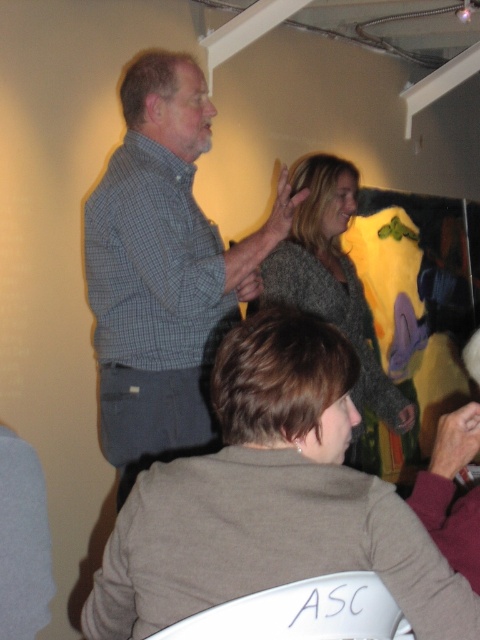
Question: Which is farther from the matte gray sweater at lower center?

Choices:
 (A) knitted gray sweater at upper center
 (B) velvet maroon sweater at lower right
 (C) gray checkered shirt at center

Answer: (A)

Question: Where is matte gray sweater at lower center located in relation to velvet maroon sweater at lower right in the image?

Choices:
 (A) below
 (B) above

Answer: (A)

Question: Which object is farther from the camera taking this photo?

Choices:
 (A) gray checkered shirt at center
 (B) matte gray sweater at lower center
 (C) velvet maroon sweater at lower right

Answer: (A)

Question: Can you confirm if gray checkered shirt at center is positioned to the left of velvet maroon sweater at lower right?

Choices:
 (A) no
 (B) yes

Answer: (B)

Question: Can you confirm if matte gray sweater at lower center is positioned above knitted gray sweater at upper center?

Choices:
 (A) no
 (B) yes

Answer: (A)

Question: Which object appears closest to the camera in this image?

Choices:
 (A) gray checkered shirt at center
 (B) matte gray sweater at lower center
 (C) knitted gray sweater at upper center
 (D) velvet maroon sweater at lower right

Answer: (B)